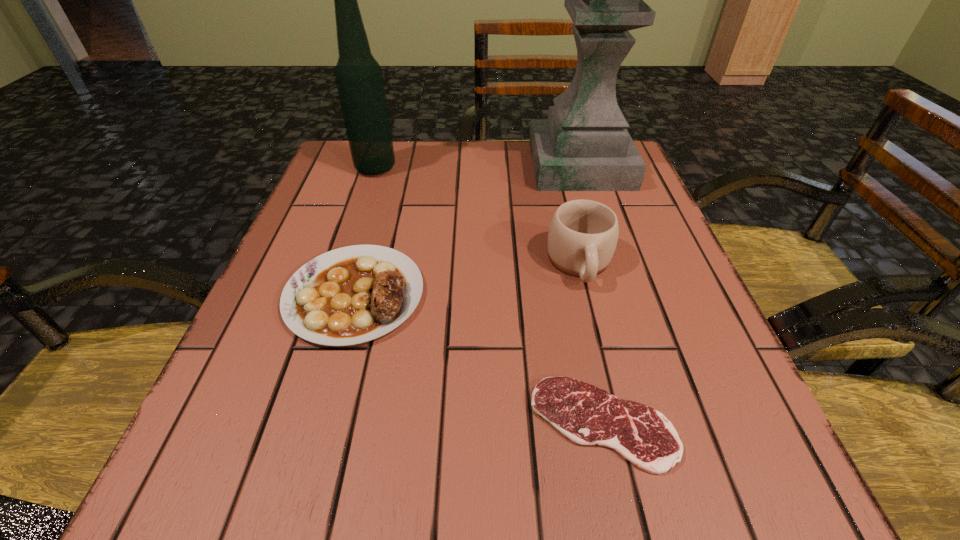
Locate an element on the screen. The image size is (960, 540). sculpture is located at coordinates (584, 145).

This screenshot has width=960, height=540. What are the coordinates of `alcohol` in the screenshot? It's located at (359, 79).

At what (x,y) coordinates should I click in order to perform the action: click on mug. Please return your answer as a coordinate pair (x, y). This screenshot has width=960, height=540. Looking at the image, I should click on (583, 234).

You are a GUI agent. You are given a task and a screenshot of the screen. Output one action in this format:
    pyautogui.click(x=<x>, y=<y>)
    Task: Click on the fourth tallest object
    Image resolution: width=960 pixels, height=540 pixels.
    Given the screenshot: What is the action you would take?
    pyautogui.click(x=354, y=294)

At what (x,y) coordinates should I click in order to perform the action: click on the taller steak. Please return your answer as a coordinate pair (x, y). The width and height of the screenshot is (960, 540). Looking at the image, I should click on (354, 294).

At what (x,y) coordinates should I click in order to perform the action: click on the nearer steak. Please return your answer as a coordinate pair (x, y). The width and height of the screenshot is (960, 540). Looking at the image, I should click on (587, 415).

This screenshot has height=540, width=960. What are the coordinates of `the shortest object` in the screenshot? It's located at (587, 415).

Locate an element on the screen. free space located at the front opening of the tallest object is located at coordinates (426, 165).

Where is `blank space located at the front opening of the tallest object`? The image size is (960, 540). blank space located at the front opening of the tallest object is located at coordinates click(x=415, y=165).

This screenshot has height=540, width=960. In order to click on free location located at the front opening of the tallest object in this screenshot , I will do `click(500, 165)`.